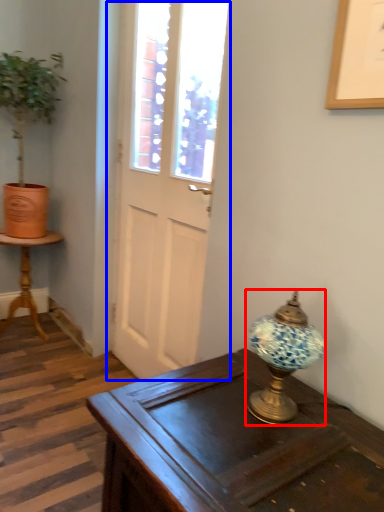
Question: Which of the following is the farthest to the observer, lamp (highlighted by a red box) or door (highlighted by a blue box)?

Choices:
 (A) lamp
 (B) door

Answer: (B)